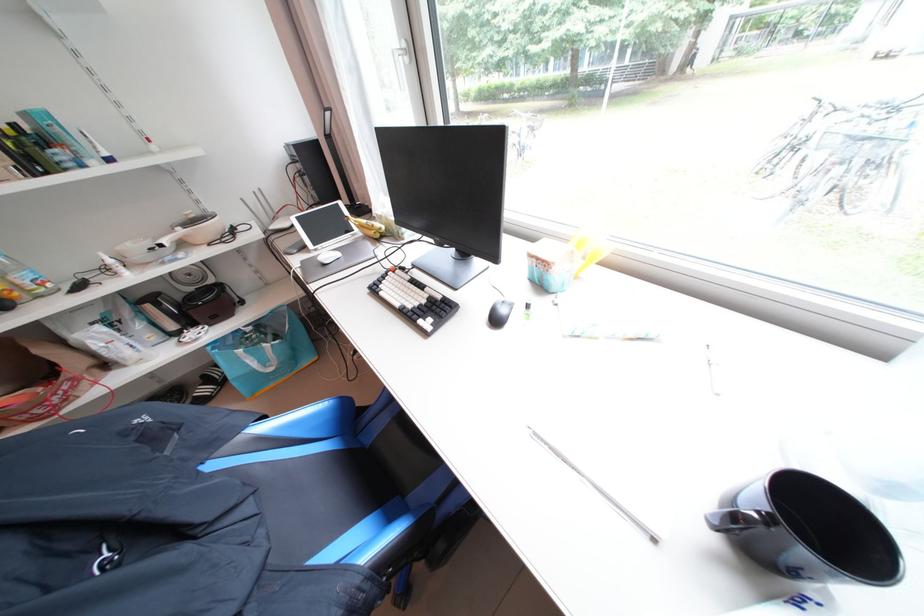
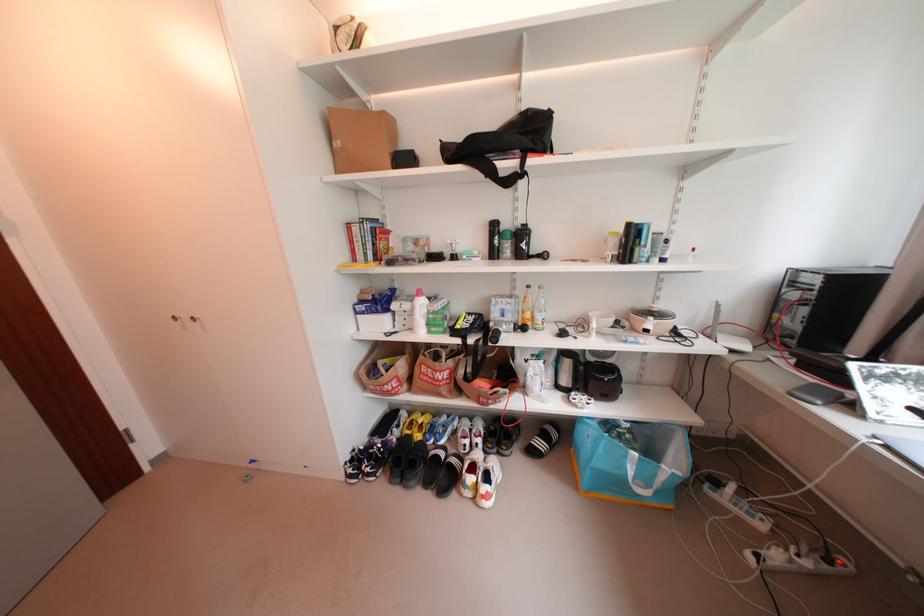
Where in the second image is the point corresponding to point 188,328 from the first image?

(578, 387)